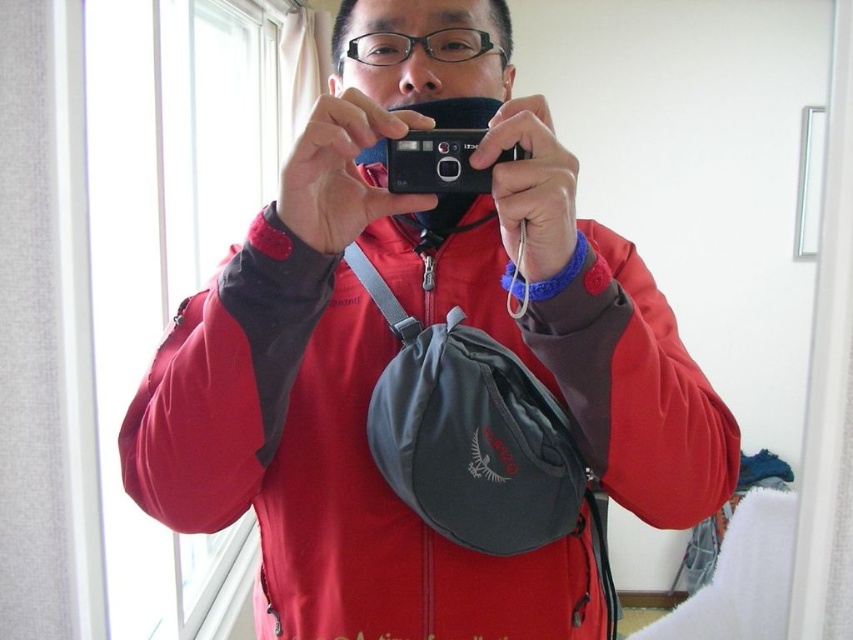
You are a photographer trying to capture a portrait of the person in the matte red jacket at center and the black plastic camera at center. If you want to ensure both are fully visible in the frame, which object should you focus on first to avoid cropping?

The matte red jacket at center has a greater height compared to the black plastic camera at center, so you should focus on positioning the matte red jacket at center first to ensure it fits entirely within the frame before adjusting for the smaller black plastic camera at center.

Consider the image. You are standing in a hotel room and see the matte red jacket at center. If you want to place a small sticker exactly where the jacket is located, what are the coordinates you should aim for?

The coordinates for the matte red jacket at center are at point (320, 465), so you should aim for those coordinates to place the sticker.

You are standing in the hotel room and want to determine which of the two points, point (177, 467) or point (419, 172), is closer to you. Based on the spatial relationships in the scene, which point is nearer?

Point (177, 467) is further to the viewer than point (419, 172), so the closer point to you is point (419, 172).